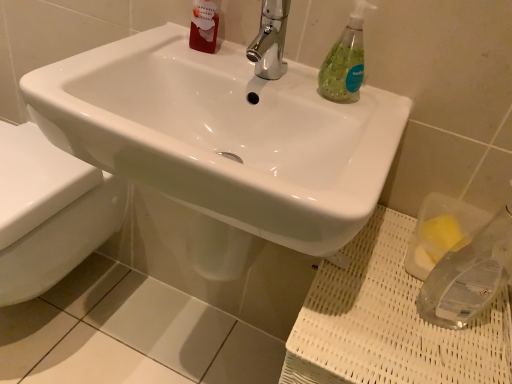
Find the location of a particular element. The height and width of the screenshot is (384, 512). vacant area that lies to the right of chrome metallic faucet at upper center is located at coordinates (334, 105).